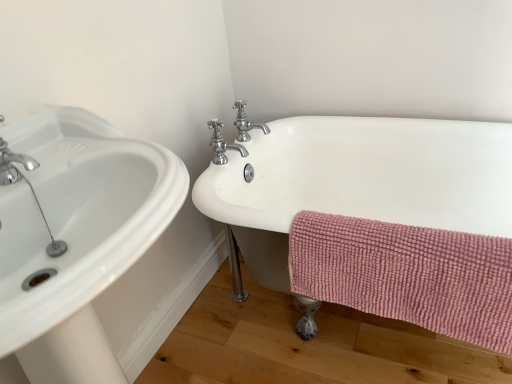
Describe the element at coordinates (407, 274) in the screenshot. I see `pink chenille towel at lower right` at that location.

Measure the distance between polished chrome faucet at upper center, which is counted as the 1th tap, starting from the front, and camera.

polished chrome faucet at upper center, which is counted as the 1th tap, starting from the front, is 1.35 meters from camera.

Describe the element at coordinates (222, 144) in the screenshot. I see `polished chrome faucet at upper center, the second tap when ordered from back to front` at that location.

The height and width of the screenshot is (384, 512). Describe the element at coordinates (358, 180) in the screenshot. I see `white ceramic bathtub at right` at that location.

Locate an element on the screen. white glossy sink at left is located at coordinates (78, 215).

Where is `pink chenille towel at lower right`? pink chenille towel at lower right is located at coordinates (407, 274).

In the scene shown: Can you tell me how much pink chenille towel at lower right and chrome/metallic faucet at upper center, acting as the first tap starting from the back, differ in facing direction?

There is a 88-degree angle between the facing directions of pink chenille towel at lower right and chrome/metallic faucet at upper center, acting as the first tap starting from the back.

Considering the positions of points (398, 299) and (257, 126), is point (398, 299) closer to camera compared to point (257, 126)?

Yes, it is.

Is pink chenille towel at lower right inside the boundaries of chrome/metallic faucet at upper center, positioned as the second tap in front-to-back order, or outside?

pink chenille towel at lower right exists outside the volume of chrome/metallic faucet at upper center, positioned as the second tap in front-to-back order.

Is pink chenille towel at lower right far away from chrome/metallic faucet at upper center, positioned as the second tap in front-to-back order?

No.

From the image's perspective, which is below, white ceramic bathtub at right or white glossy sink at left?

white glossy sink at left, from the image's perspective.

From a real-world perspective, relative to white glossy sink at left, is white ceramic bathtub at right vertically above or below?

white ceramic bathtub at right is situated lower than white glossy sink at left in the real world.

Can white glossy sink at left be found inside white ceramic bathtub at right?

No, white ceramic bathtub at right does not contain white glossy sink at left.

Which of these two, white ceramic bathtub at right or white glossy sink at left, stands taller?

With more height is white glossy sink at left.

In terms of size, does chrome/metallic faucet at upper center, acting as the first tap starting from the back, appear bigger or smaller than pink chenille towel at lower right?

chrome/metallic faucet at upper center, acting as the first tap starting from the back, is smaller than pink chenille towel at lower right.

Based on the photo, is chrome/metallic faucet at upper center, positioned as the second tap in front-to-back order, facing away from pink chenille towel at lower right?

chrome/metallic faucet at upper center, positioned as the second tap in front-to-back order, is not turned away from pink chenille towel at lower right.

How different are the orientations of chrome/metallic faucet at upper center, positioned as the second tap in front-to-back order, and pink chenille towel at lower right in degrees?

88 degrees.

Would you say pink chenille towel at lower right is a long distance from white ceramic bathtub at right?

No, pink chenille towel at lower right is in close proximity to white ceramic bathtub at right.

Is pink chenille towel at lower right behind white ceramic bathtub at right?

Yes.

From a real-world perspective, which is physically above, pink chenille towel at lower right or white ceramic bathtub at right?

From a 3D spatial view, pink chenille towel at lower right is above.

Between pink chenille towel at lower right and white ceramic bathtub at right, which one has larger width?

Wider between the two is white ceramic bathtub at right.

Between chrome/metallic faucet at upper center, positioned as the second tap in front-to-back order, and white ceramic bathtub at right, which one appears on the left side from the viewer's perspective?

chrome/metallic faucet at upper center, positioned as the second tap in front-to-back order, is more to the left.

Is chrome/metallic faucet at upper center, acting as the first tap starting from the back, thinner than white ceramic bathtub at right?

Yes.

From a real-world perspective, count 2nd taps upward from the white ceramic bathtub at right and point to it. Please provide its 2D coordinates.

[(246, 122)]

Is white ceramic bathtub at right located within chrome/metallic faucet at upper center, acting as the first tap starting from the back?

No, white ceramic bathtub at right is not inside chrome/metallic faucet at upper center, acting as the first tap starting from the back.

Does white ceramic bathtub at right appear on the left side of polished chrome faucet at upper center, the second tap when ordered from back to front?

No.

Measure the distance from white ceramic bathtub at right to polished chrome faucet at upper center, which is counted as the 1th tap, starting from the front.

white ceramic bathtub at right and polished chrome faucet at upper center, which is counted as the 1th tap, starting from the front, are 15.25 inches apart from each other.

Does white ceramic bathtub at right have a greater width compared to polished chrome faucet at upper center, which is counted as the 1th tap, starting from the front?

Yes, white ceramic bathtub at right is wider than polished chrome faucet at upper center, which is counted as the 1th tap, starting from the front.

Does point (253, 246) come farther from viewer compared to point (239, 145)?

No, (253, 246) is in front of (239, 145).

Which tap is the 2nd one when counting from the back of the white glossy sink at left? Please provide its 2D coordinates.

[(246, 122)]

Considering the relative positions of white glossy sink at left and chrome/metallic faucet at upper center, positioned as the second tap in front-to-back order, in the image provided, is white glossy sink at left to the left of chrome/metallic faucet at upper center, positioned as the second tap in front-to-back order, from the viewer's perspective?

Correct, you'll find white glossy sink at left to the left of chrome/metallic faucet at upper center, positioned as the second tap in front-to-back order.

Based on the photo, from a real-world perspective, is white glossy sink at left physically located above or below chrome/metallic faucet at upper center, acting as the first tap starting from the back?

In terms of real-world spatial position, white glossy sink at left is below chrome/metallic faucet at upper center, acting as the first tap starting from the back.

Locate an element on the screen. bath towel in front of the chrome/metallic faucet at upper center, acting as the first tap starting from the back is located at coordinates (407, 274).

Where is `sink below the white ceramic bathtub at right (from the image's perspective)`? The height and width of the screenshot is (384, 512). sink below the white ceramic bathtub at right (from the image's perspective) is located at coordinates (78, 215).

Considering their positions, is polished chrome faucet at upper center, which is counted as the 1th tap, starting from the front, positioned closer to pink chenille towel at lower right than chrome/metallic faucet at upper center, positioned as the second tap in front-to-back order?

Based on the image, polished chrome faucet at upper center, which is counted as the 1th tap, starting from the front, appears to be nearer to pink chenille towel at lower right.

Which object lies nearer to the anchor point white glossy sink at left, pink chenille towel at lower right or chrome/metallic faucet at upper center, positioned as the second tap in front-to-back order?

pink chenille towel at lower right.

Based on their spatial positions, is chrome/metallic faucet at upper center, positioned as the second tap in front-to-back order, or polished chrome faucet at upper center, which is counted as the 1th tap, starting from the front, closer to white ceramic bathtub at right?

The object closer to white ceramic bathtub at right is polished chrome faucet at upper center, which is counted as the 1th tap, starting from the front.

Based on their spatial positions, is pink chenille towel at lower right or white glossy sink at left closer to chrome/metallic faucet at upper center, positioned as the second tap in front-to-back order?

pink chenille towel at lower right is positioned closer to the anchor chrome/metallic faucet at upper center, positioned as the second tap in front-to-back order.

Looking at the image, which one is located closer to chrome/metallic faucet at upper center, acting as the first tap starting from the back, white ceramic bathtub at right or pink chenille towel at lower right?

white ceramic bathtub at right lies closer to chrome/metallic faucet at upper center, acting as the first tap starting from the back, than the other object.

From the image, which object appears to be nearer to white ceramic bathtub at right, pink chenille towel at lower right or chrome/metallic faucet at upper center, acting as the first tap starting from the back?

The object closer to white ceramic bathtub at right is pink chenille towel at lower right.

When comparing their distances from pink chenille towel at lower right, does chrome/metallic faucet at upper center, acting as the first tap starting from the back, or white ceramic bathtub at right seem further?

Among the two, chrome/metallic faucet at upper center, acting as the first tap starting from the back, is located further to pink chenille towel at lower right.

Considering their positions, is white ceramic bathtub at right positioned closer to white glossy sink at left than polished chrome faucet at upper center, the second tap when ordered from back to front?

polished chrome faucet at upper center, the second tap when ordered from back to front.

Where is `bath towel between white glossy sink at left and polished chrome faucet at upper center, which is counted as the 1th tap, starting from the front, in the front-back direction`? Image resolution: width=512 pixels, height=384 pixels. bath towel between white glossy sink at left and polished chrome faucet at upper center, which is counted as the 1th tap, starting from the front, in the front-back direction is located at coordinates (407, 274).

Identify the location of tap between white ceramic bathtub at right and chrome/metallic faucet at upper center, positioned as the second tap in front-to-back order, from front to back. The width and height of the screenshot is (512, 384). (222, 144).

Where is `bath towel between white glossy sink at left and white ceramic bathtub at right in the horizontal direction`? This screenshot has height=384, width=512. bath towel between white glossy sink at left and white ceramic bathtub at right in the horizontal direction is located at coordinates (407, 274).

You are a GUI agent. You are given a task and a screenshot of the screen. Output one action in this format:
    pyautogui.click(x=<x>, y=<y>)
    Task: Click on the bathtub between white glossy sink at left and polished chrome faucet at upper center, the second tap when ordered from back to front, from front to back
    The width and height of the screenshot is (512, 384).
    Given the screenshot: What is the action you would take?
    pyautogui.click(x=358, y=180)